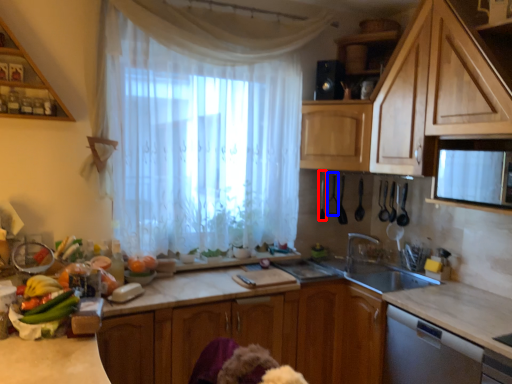
Question: Which of the following is the closest to the observer, appliance (highlighted by a red box) or appliance (highlighted by a blue box)?

Choices:
 (A) appliance
 (B) appliance

Answer: (A)